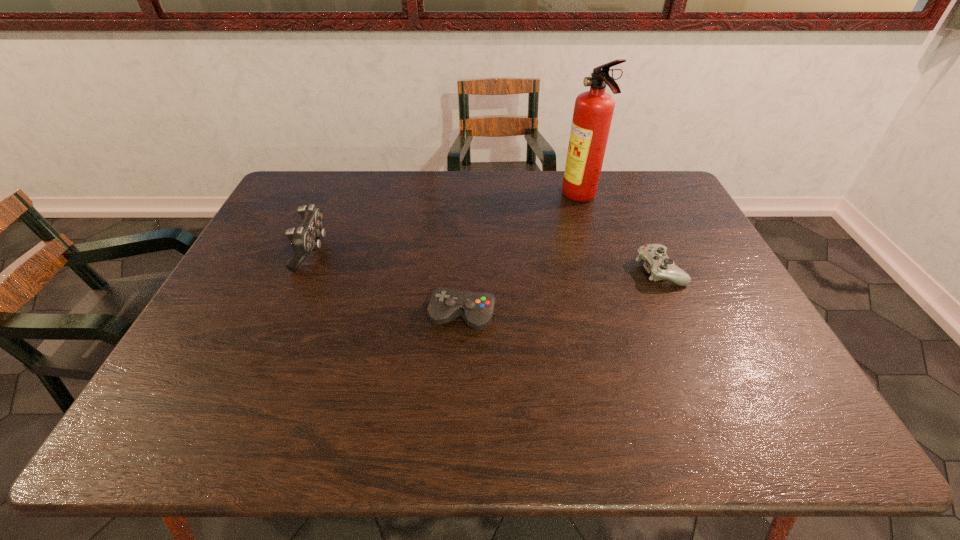
What are the coordinates of `free space between the tallest control and the tallest object` in the screenshot? It's located at (446, 225).

Identify which object is the third nearest to the nearest control. Please provide its 2D coordinates. Your answer should be formatted as a tuple, i.e. [(x, y)], where the tuple contains the x and y coordinates of a point satisfying the conditions above.

[(593, 110)]

In order to click on object that is the closest one to the nearest control in this screenshot , I will do `click(306, 238)`.

At what (x,y) coordinates should I click in order to perform the action: click on the second closest control to the tallest control. Please return your answer as a coordinate pair (x, y). The width and height of the screenshot is (960, 540). Looking at the image, I should click on pyautogui.click(x=656, y=262).

Identify the location of control that is the closest one to the leftmost object. This screenshot has height=540, width=960. pos(477,309).

Where is `blank area in the image that satisfies the following two spatial constraints: 1. on the back side of the second object from left to right; 2. on the right side of the rightmost control`? The width and height of the screenshot is (960, 540). blank area in the image that satisfies the following two spatial constraints: 1. on the back side of the second object from left to right; 2. on the right side of the rightmost control is located at coordinates (464, 269).

Identify the location of free location that satisfies the following two spatial constraints: 1. on the front-facing side of the third object from left to right; 2. on the front side of the third object from right to left. (616, 316).

Identify the location of free space that satisfies the following two spatial constraints: 1. on the surface of the leftmost control with buttons; 2. on the right side of the nearest object. Image resolution: width=960 pixels, height=540 pixels. (284, 316).

Locate an element on the screen. vacant space that satisfies the following two spatial constraints: 1. on the surface of the nearest object with buttons; 2. on the right side of the second tallest object is located at coordinates (284, 316).

The width and height of the screenshot is (960, 540). I want to click on vacant space that satisfies the following two spatial constraints: 1. on the front-facing side of the third object from left to right; 2. on the front side of the second object from left to right, so click(x=616, y=316).